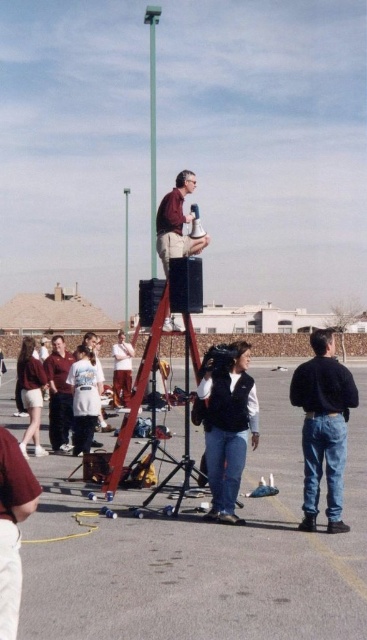
Is smooth asphalt tarmac at center to the left of denim vest at center from the viewer's perspective?

Indeed, smooth asphalt tarmac at center is positioned on the left side of denim vest at center.

Who is more distant from viewer, [271,579] or [230,518]?

Positioned behind is point [230,518].

At what (x,y) coordinates should I click in order to perform the action: click on smooth asphalt tarmac at center. Please return your answer as a coordinate pair (x, y). Looking at the image, I should click on (205, 554).

Can you confirm if smooth asphalt tarmac at center is bigger than matte maroon hoodie at left?

No, smooth asphalt tarmac at center is not bigger than matte maroon hoodie at left.

Which of these two, smooth asphalt tarmac at center or matte maroon hoodie at left, stands shorter?

Standing shorter between the two is smooth asphalt tarmac at center.

Where is `smooth asphalt tarmac at center`? The height and width of the screenshot is (640, 367). smooth asphalt tarmac at center is located at coordinates (205, 554).

Between smooth asphalt tarmac at center and light brown pants at center, which one has more height?

Standing taller between the two is light brown pants at center.

Where is `smooth asphalt tarmac at center`? The image size is (367, 640). smooth asphalt tarmac at center is located at coordinates (205, 554).